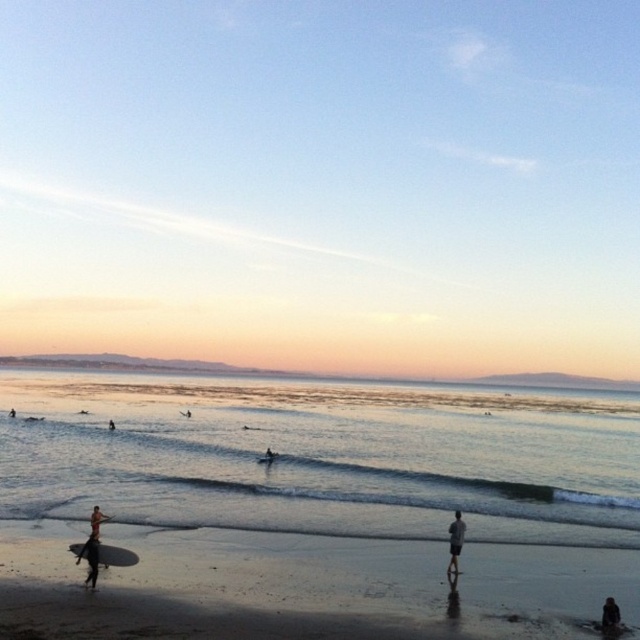
Does point (451, 525) lie behind point (90, 518)?

That is False.

Measure the distance between dark gray fabric shorts at center and camera.

17.47 meters

This screenshot has height=640, width=640. What are the coordinates of `dark gray fabric shorts at center` in the screenshot? It's located at (456, 541).

Identify the location of dark gray fabric shorts at center. The width and height of the screenshot is (640, 640). (456, 541).

Between dark fabric figure at lower right and dark blue wetsuit at center, which one appears on the left side from the viewer's perspective?

From the viewer's perspective, dark blue wetsuit at center appears more on the left side.

Is point (614, 612) less distant than point (108, 429)?

Yes, it is in front of point (108, 429).

Image resolution: width=640 pixels, height=640 pixels. I want to click on dark fabric figure at lower right, so click(x=611, y=614).

Does smooth sand at lower center appear over white matte surfboard at lower left?

No.

Does smooth sand at lower center come in front of white matte surfboard at lower left?

Yes, it is in front of white matte surfboard at lower left.

The width and height of the screenshot is (640, 640). Describe the element at coordinates (304, 586) in the screenshot. I see `smooth sand at lower center` at that location.

Identify the location of smooth sand at lower center. This screenshot has height=640, width=640. (304, 586).